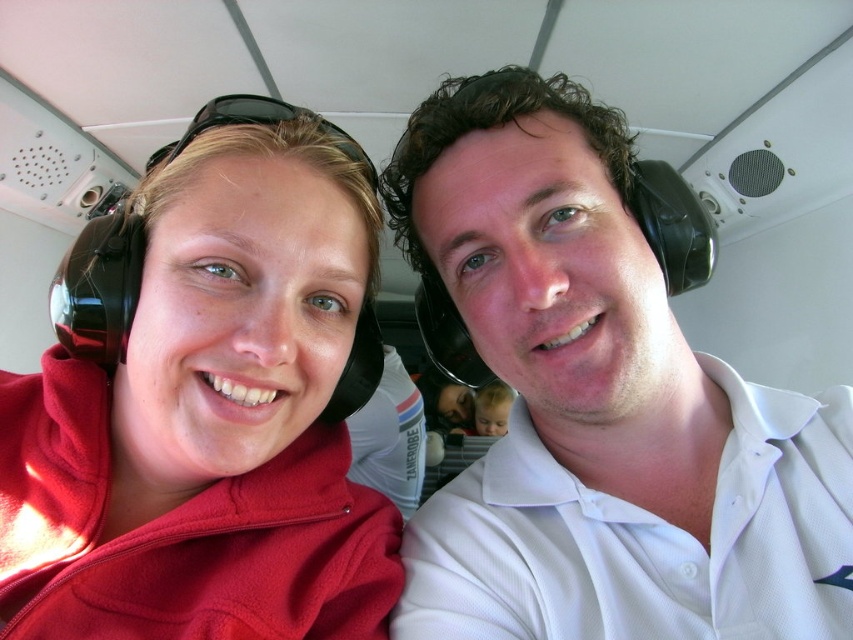
Question: Which point is closer to the camera?

Choices:
 (A) matte fleece jacket at left
 (B) smooth skin baby at center

Answer: (A)

Question: Does matte fleece jacket at left have a lesser width compared to smooth skin baby at center?

Choices:
 (A) yes
 (B) no

Answer: (B)

Question: Based on their relative distances, which object is farther from the matte fleece jacket at left?

Choices:
 (A) white matte shirt at center
 (B) smooth skin baby at center

Answer: (B)

Question: Does white matte shirt at center appear over matte fleece jacket at left?

Choices:
 (A) no
 (B) yes

Answer: (B)

Question: Does white matte shirt at center appear on the left side of smooth skin baby at center?

Choices:
 (A) yes
 (B) no

Answer: (A)

Question: Which object is farther from the camera taking this photo?

Choices:
 (A) matte fleece jacket at left
 (B) white matte shirt at center
 (C) smooth skin baby at center

Answer: (C)